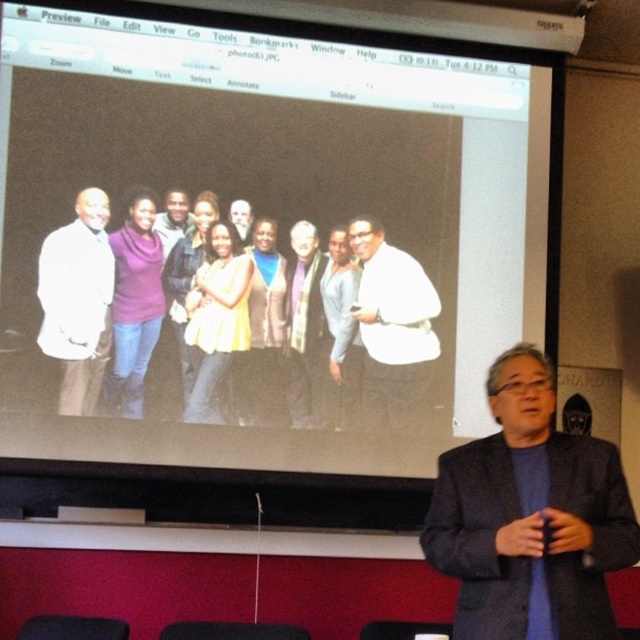
You are an attendee at a presentation. You see a point marked at coordinates (x=529, y=516) on the screen. What object does this point correspond to?

The point corresponds to the gray wool blazer at right.

You are an attendee at the presentation and you notice two points marked on the screen. The first point is at coordinate point (x=609, y=467) and the second point is at coordinate point (x=132, y=278). Which point is closer to you as you look at the screen?

Point (x=609, y=467) is in front of point (x=132, y=278), so the first point is closer to you.